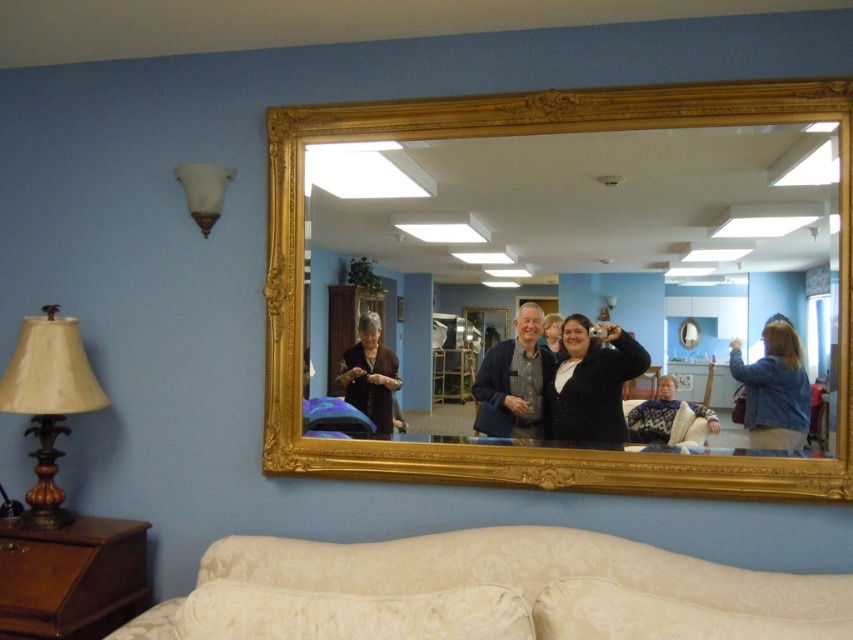
You are standing in the room and want to sit down on the creamy fabric couch at lower center. Based on its position, where should you walk to in the room?

The creamy fabric couch at lower center is located at point [489,592] in the room, so you should walk towards the lower center area to reach it.

You are standing in the room and want to adjust the lighting by turning on the matte beige lampshade at left. However, you need to reach the switch first. Since the matte brown sweater at center is in the way, can you determine if the lampshade is above or below the sweater to navigate around it?

The matte beige lampshade at left is located below the matte brown sweater at center, so you should move around the sweater to access the lampshade from below.